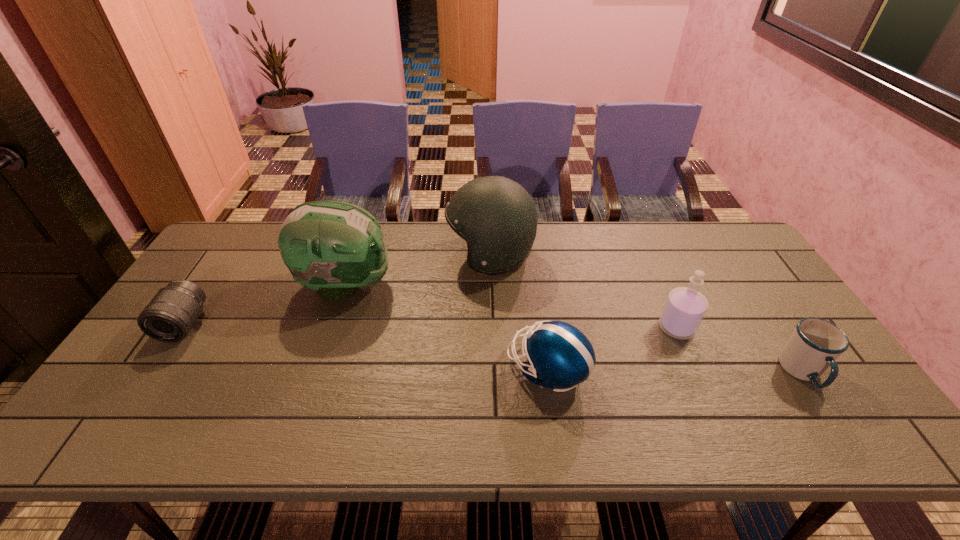
Where is `the leftmost football helmet`? the leftmost football helmet is located at coordinates pos(334,248).

Locate an element on the screen. Image resolution: width=960 pixels, height=540 pixels. the third tallest object is located at coordinates pyautogui.click(x=685, y=307).

Image resolution: width=960 pixels, height=540 pixels. Identify the location of perfume. (685, 307).

Identify the location of the nearest football helmet. (560, 356).

I want to click on the fourth tallest object, so click(x=560, y=356).

Find the location of a particular element. The width and height of the screenshot is (960, 540). the rightmost object is located at coordinates (815, 344).

Image resolution: width=960 pixels, height=540 pixels. Find the location of `the leftmost object`. the leftmost object is located at coordinates (170, 315).

I want to click on vacant space located on the visor of the second object from left to right, so click(x=479, y=285).

The image size is (960, 540). Find the location of `blank space located 0.330m on the left of the fifth object from left to right`. blank space located 0.330m on the left of the fifth object from left to right is located at coordinates (539, 328).

Locate an element on the screen. The image size is (960, 540). free space located at the front of the fourth tallest object with the faceguard is located at coordinates (436, 369).